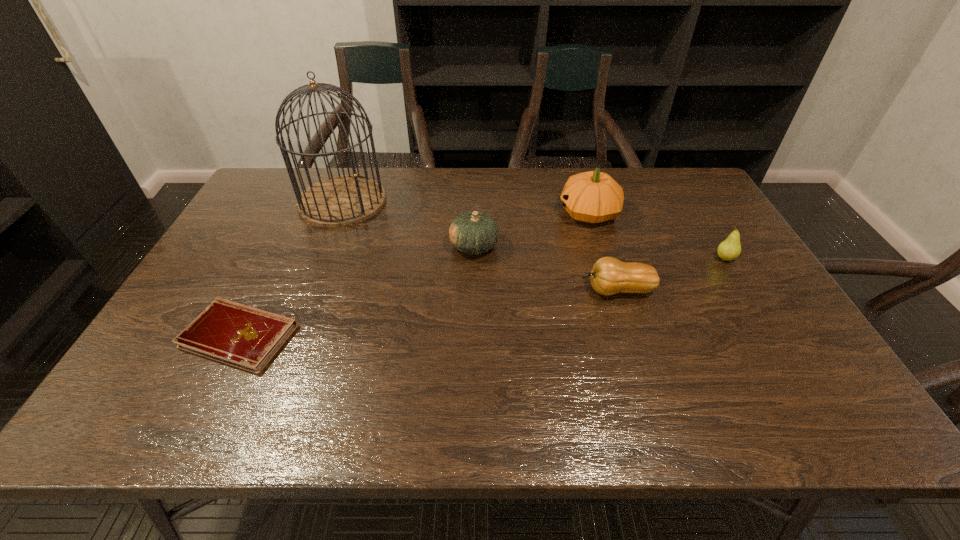
You are a GUI agent. You are given a task and a screenshot of the screen. Output one action in this format:
    pyautogui.click(x=<x>, y=<y>)
    Task: Click on the birdcage
    
    Given the screenshot: What is the action you would take?
    pyautogui.click(x=340, y=201)

Where is `the fifth shortest object`? The height and width of the screenshot is (540, 960). the fifth shortest object is located at coordinates (592, 197).

Identify the location of pear. (730, 249).

This screenshot has height=540, width=960. In order to click on the fourth object from right to left in this screenshot , I will do `click(473, 232)`.

Image resolution: width=960 pixels, height=540 pixels. I want to click on the nearest gourd, so click(x=609, y=276).

Where is `notebook`? The width and height of the screenshot is (960, 540). notebook is located at coordinates (238, 335).

Where is `vacant region located 0.080m at the door of the birdcage`? The height and width of the screenshot is (540, 960). vacant region located 0.080m at the door of the birdcage is located at coordinates (410, 201).

The height and width of the screenshot is (540, 960). I want to click on vacant space located on the side of the tallest gourd with the carved face, so click(470, 213).

What are the coordinates of `free point located 0.370m on the side of the tallest gourd with the carved face` in the screenshot? It's located at (442, 213).

You are a GUI agent. You are given a task and a screenshot of the screen. Output one action in this format:
    pyautogui.click(x=<x>, y=<y>)
    Task: Click on the free point located 0.310m on the side of the tallest gourd with the carved face
    
    Given the screenshot: What is the action you would take?
    pyautogui.click(x=461, y=213)